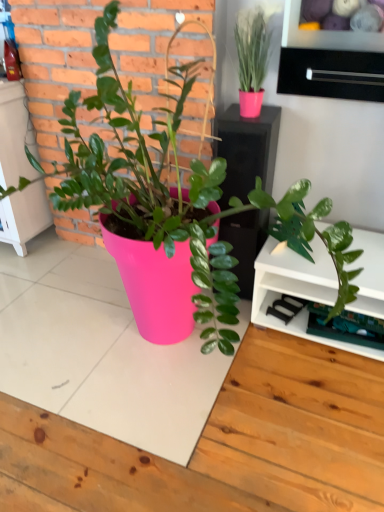
Question: Should I look upward or downward to see pink matte pot at center?

Choices:
 (A) down
 (B) up

Answer: (B)

Question: Does black matte drawer at upper right come behind pink matte pot at center?

Choices:
 (A) yes
 (B) no

Answer: (A)

Question: Does black matte drawer at upper right have a greater width compared to pink matte pot at center?

Choices:
 (A) yes
 (B) no

Answer: (B)

Question: Is black matte drawer at upper right shorter than pink matte pot at center?

Choices:
 (A) no
 (B) yes

Answer: (B)

Question: Is black matte drawer at upper right thinner than pink matte pot at center?

Choices:
 (A) no
 (B) yes

Answer: (B)

Question: From a real-world perspective, is black matte drawer at upper right beneath pink matte pot at center?

Choices:
 (A) no
 (B) yes

Answer: (A)

Question: Is black matte drawer at upper right to the left of pink matte pot at center from the viewer's perspective?

Choices:
 (A) yes
 (B) no

Answer: (B)

Question: Is pink matte pot at center positioned in front of black matte drawer at upper right?

Choices:
 (A) no
 (B) yes

Answer: (B)

Question: Is pink matte pot at center wider than black matte drawer at upper right?

Choices:
 (A) yes
 (B) no

Answer: (A)

Question: From the image's perspective, does pink matte pot at center appear higher than black matte drawer at upper right?

Choices:
 (A) no
 (B) yes

Answer: (A)

Question: From the image's perspective, is pink matte pot at center beneath black matte drawer at upper right?

Choices:
 (A) yes
 (B) no

Answer: (A)

Question: Is pink matte pot at center further to the viewer compared to black matte drawer at upper right?

Choices:
 (A) yes
 (B) no

Answer: (B)

Question: Is pink matte pot at center facing towards black matte drawer at upper right?

Choices:
 (A) yes
 (B) no

Answer: (B)

Question: Considering the positions of black matte drawer at upper right and pink matte pot at center in the image, is black matte drawer at upper right taller or shorter than pink matte pot at center?

Choices:
 (A) tall
 (B) short

Answer: (B)